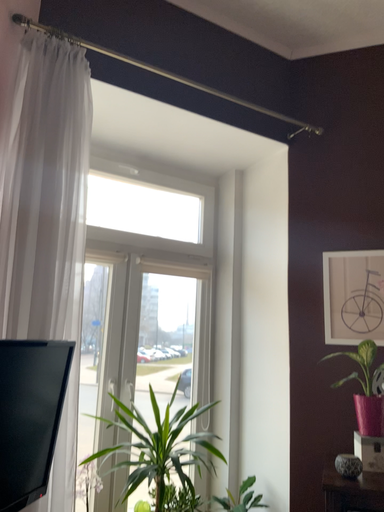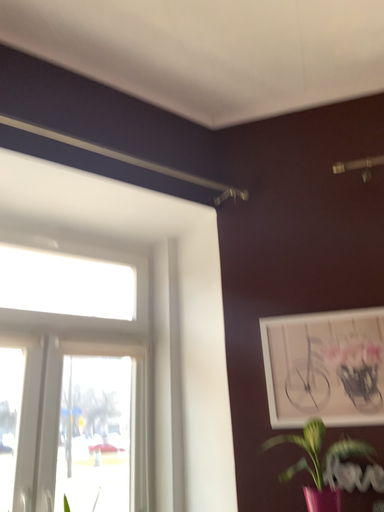
Question: How did the camera likely rotate when shooting the video?

Choices:
 (A) rotated downward
 (B) rotated upward

Answer: (B)